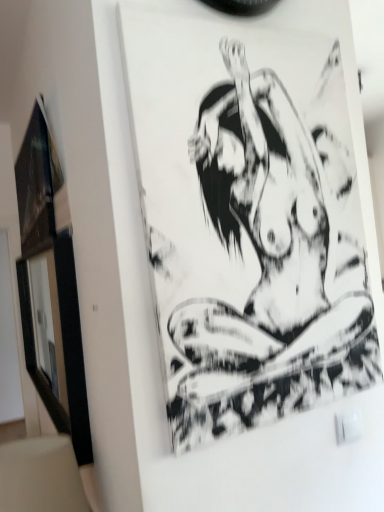
Question: Should I look upward or downward to see matte black picture frame at left?

Choices:
 (A) up
 (B) down

Answer: (A)

Question: From a real-world perspective, is matte black picture frame at left located beneath black ink drawing at center?

Choices:
 (A) yes
 (B) no

Answer: (B)

Question: Is matte black picture frame at left closer to camera compared to black ink drawing at center?

Choices:
 (A) yes
 (B) no

Answer: (B)

Question: From a real-world perspective, is matte black picture frame at left positioned over black ink drawing at center based on gravity?

Choices:
 (A) yes
 (B) no

Answer: (A)

Question: Is matte black picture frame at left outside black ink drawing at center?

Choices:
 (A) no
 (B) yes

Answer: (B)

Question: Is matte black picture frame at left at the right side of black ink drawing at center?

Choices:
 (A) yes
 (B) no

Answer: (B)

Question: Does matte black picture frame at left appear on the left side of black ink drawing at center?

Choices:
 (A) no
 (B) yes

Answer: (B)

Question: Is black ink drawing at center positioned beyond the bounds of matte black picture frame at left?

Choices:
 (A) yes
 (B) no

Answer: (A)

Question: Is black ink drawing at center facing away from matte black picture frame at left?

Choices:
 (A) no
 (B) yes

Answer: (B)

Question: Is black ink drawing at center far from matte black picture frame at left?

Choices:
 (A) no
 (B) yes

Answer: (A)

Question: Is black ink drawing at center to the right of matte black picture frame at left from the viewer's perspective?

Choices:
 (A) no
 (B) yes

Answer: (B)

Question: Is black ink drawing at center bigger than matte black picture frame at left?

Choices:
 (A) yes
 (B) no

Answer: (B)

Question: Considering the relative sizes of black ink drawing at center and matte black picture frame at left in the image provided, is black ink drawing at center thinner than matte black picture frame at left?

Choices:
 (A) yes
 (B) no

Answer: (A)

Question: Is black ink drawing at center wider or thinner than matte black picture frame at left?

Choices:
 (A) thin
 (B) wide

Answer: (A)